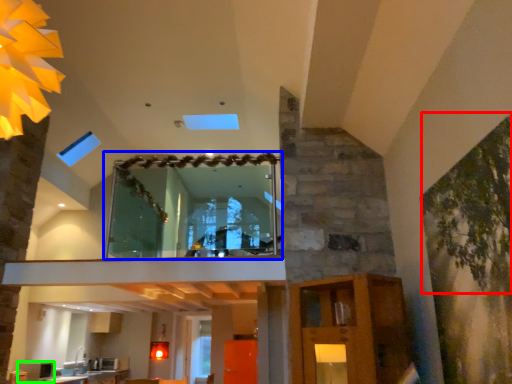
Question: Which object is the farthest from plant (highlighted by a red box)? Choose among these: window (highlighted by a blue box) or appliance (highlighted by a green box).

Choices:
 (A) window
 (B) appliance

Answer: (B)